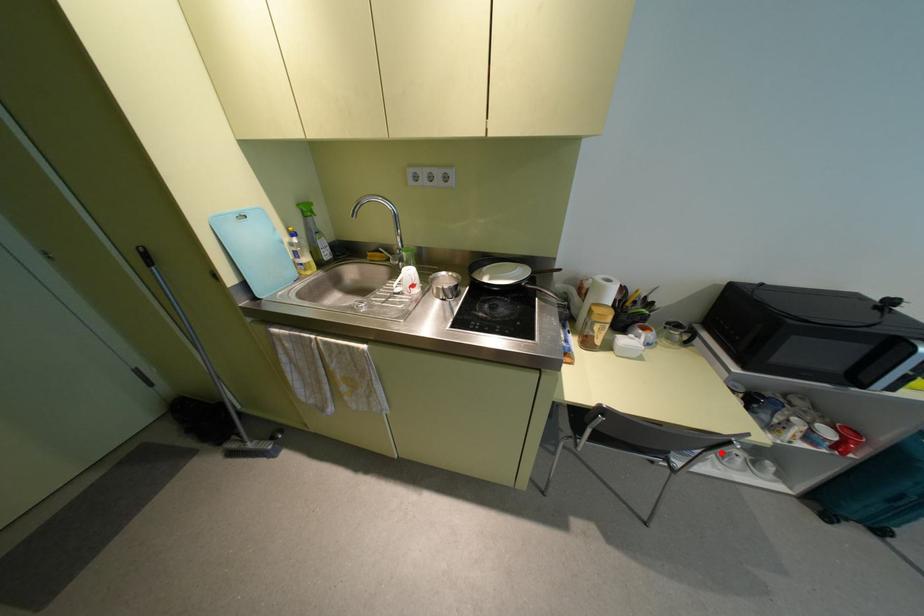
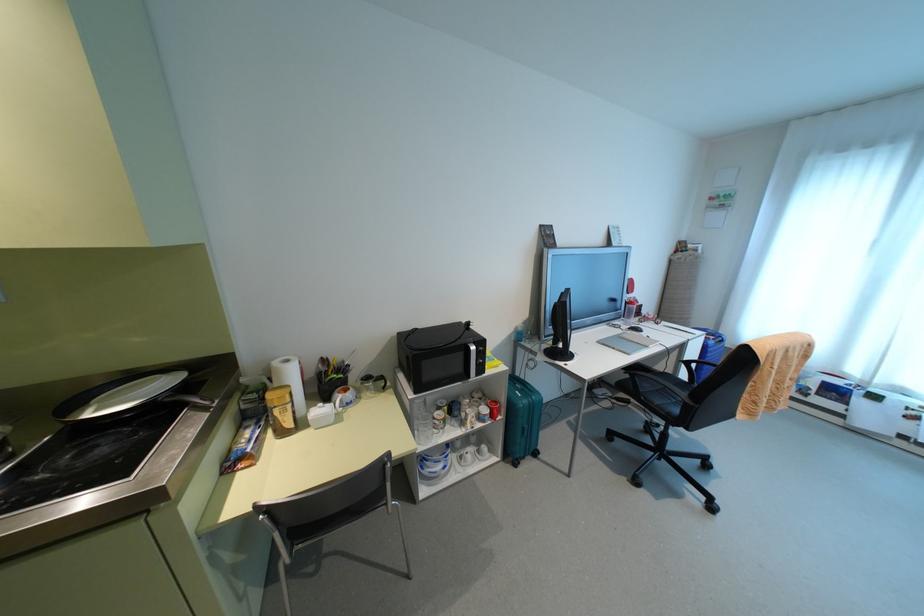
Find the pixel in the second image that matches the highlighted location in the first image.

(459, 456)